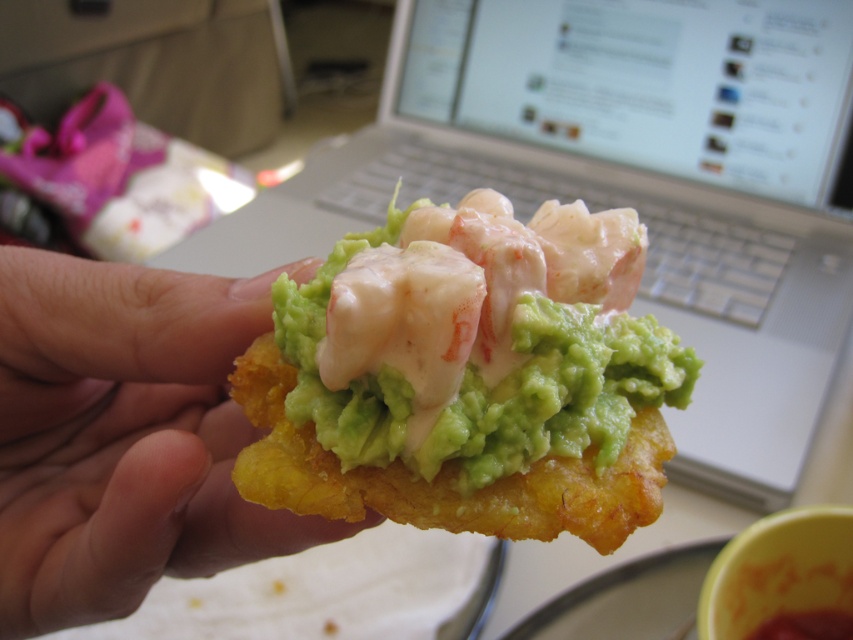
Who is higher up, silver metallic laptop at upper center or golden fried chip at center?

silver metallic laptop at upper center is above.

Does point (666, 138) come in front of point (138, 461)?

No, (666, 138) is further to viewer.

At what (x,y) coordinates should I click in order to perform the action: click on silver metallic laptop at upper center. Please return your answer as a coordinate pair (x, y). Image resolution: width=853 pixels, height=640 pixels. Looking at the image, I should click on (625, 184).

Does silver metallic laptop at upper center have a lesser height compared to green creamy guacamole at center?

Incorrect, silver metallic laptop at upper center's height does not fall short of green creamy guacamole at center's.

Is silver metallic laptop at upper center bigger than green creamy guacamole at center?

Correct, silver metallic laptop at upper center is larger in size than green creamy guacamole at center.

Locate an element on the screen. This screenshot has height=640, width=853. silver metallic laptop at upper center is located at coordinates point(625,184).

Does green creamy guacamole at center lie in front of golden fried chip at center?

Yes.

Does green creamy guacamole at center have a lesser height compared to golden fried chip at center?

Yes.

Which is behind, point (437, 289) or point (108, 540)?

The point (108, 540) is more distant.

Identify the location of green creamy guacamole at center. (479, 339).